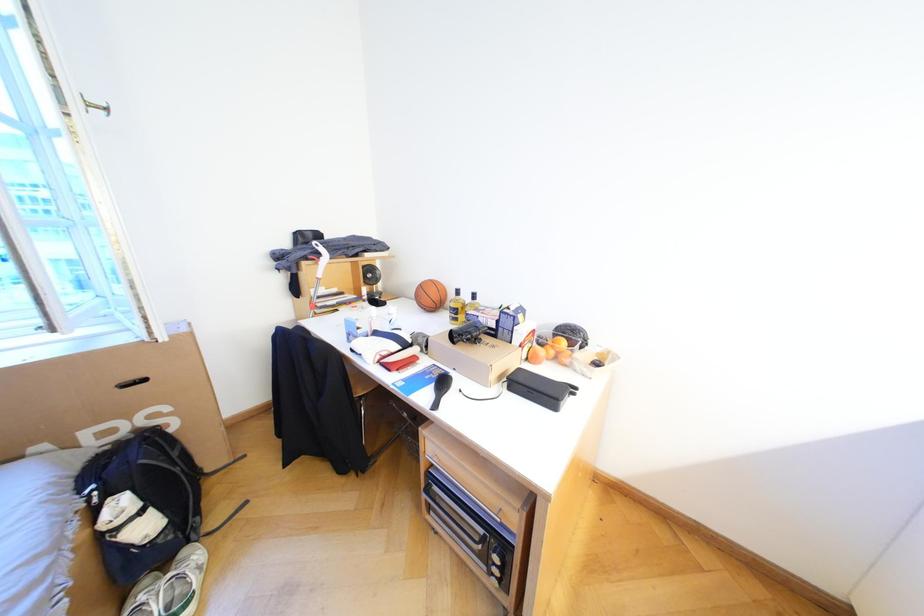
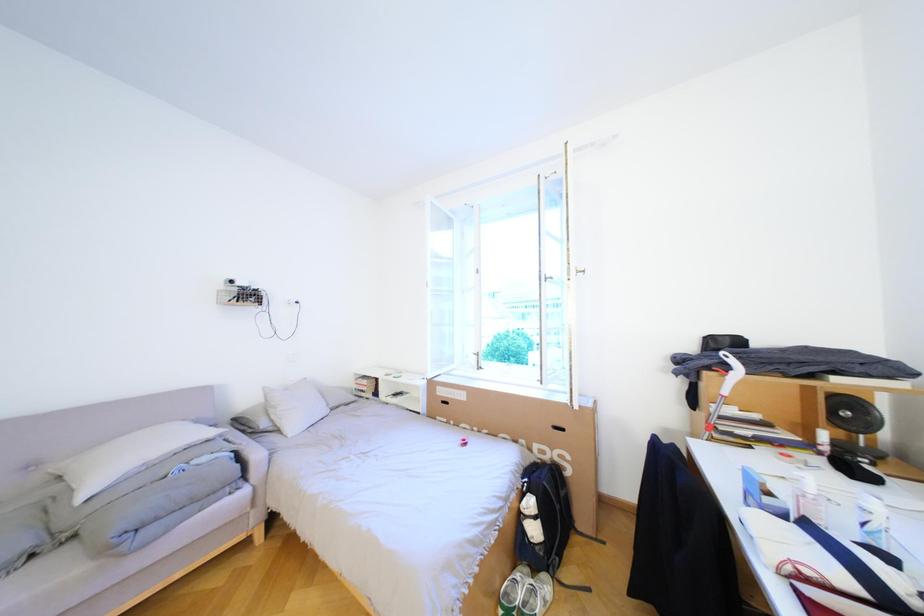
Question: How did the camera likely rotate?

Choices:
 (A) Left
 (B) Right
 (C) Up
 (D) Down

Answer: (A)